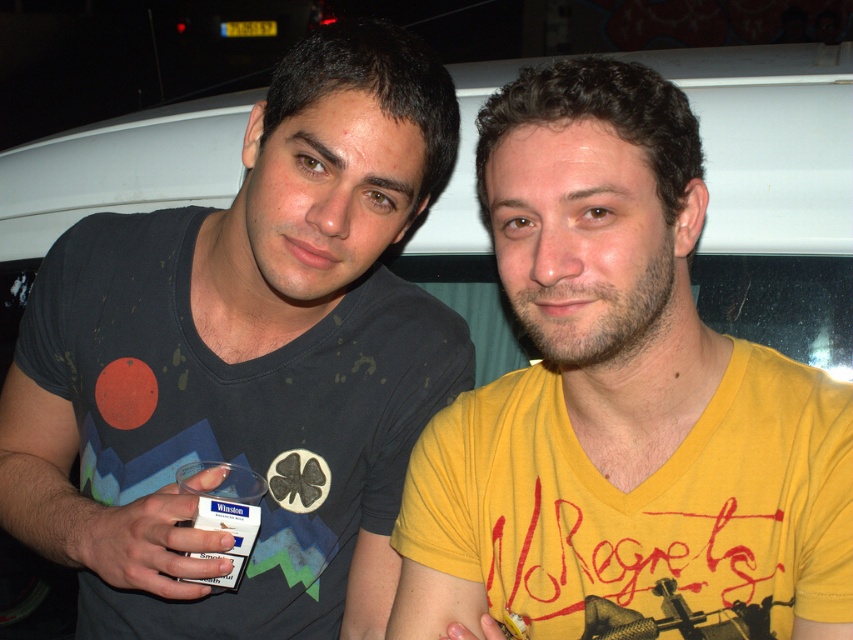
Does dark gray t-shirt at center have a greater height compared to yellow matte shirt at right?

Correct, dark gray t-shirt at center is much taller as yellow matte shirt at right.

Can you confirm if dark gray t-shirt at center is positioned below yellow matte shirt at right?

Correct, dark gray t-shirt at center is located below yellow matte shirt at right.

Locate an element on the screen. The image size is (853, 640). dark gray t-shirt at center is located at coordinates (247, 362).